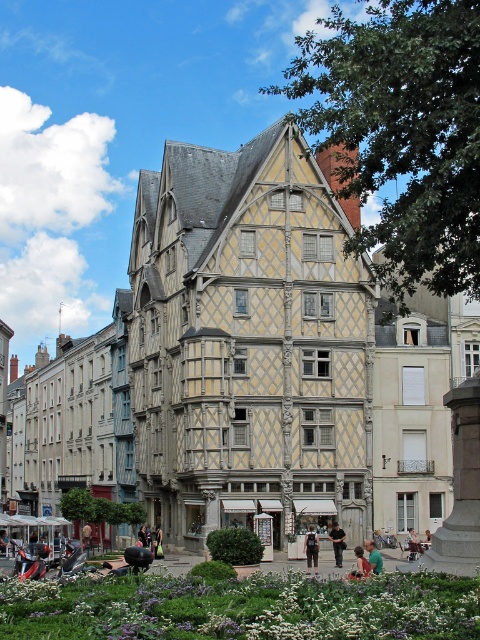
Question: Does dark gray fabric backpack at center have a larger size compared to dark blue jeans at lower center?

Choices:
 (A) yes
 (B) no

Answer: (A)

Question: Can you confirm if wooden half-timbered building at center is positioned to the right of dark blue jeans at lower center?

Choices:
 (A) yes
 (B) no

Answer: (B)

Question: Considering the real-world distances, which object is farthest from the green fabric shirt at lower center?

Choices:
 (A) green fabric chair at center
 (B) wooden half-timbered building at center
 (C) dark gray fabric backpack at center

Answer: (B)

Question: Which of these objects is positioned farthest from the green fabric shirt at lower center?

Choices:
 (A) dark gray fabric backpack at center
 (B) wooden half-timbered building at center
 (C) green fabric chair at center
 (D) dark blue jeans at lower center

Answer: (B)

Question: Among these objects, which one is farthest from the camera?

Choices:
 (A) green fabric shirt at lower center
 (B) green fabric chair at center
 (C) wooden half-timbered building at center

Answer: (B)

Question: Does wooden half-timbered building at center lie behind green fabric shirt at lower center?

Choices:
 (A) yes
 (B) no

Answer: (B)